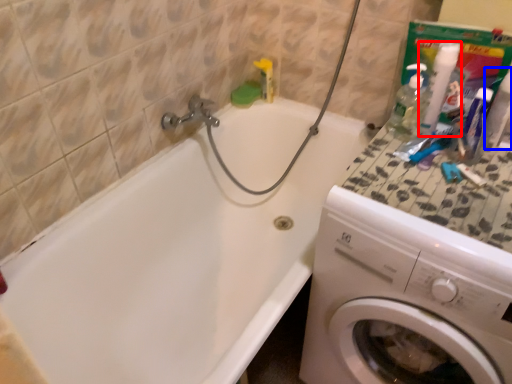
Question: Which point is closer to the camera, cleaning product (highlighted by a red box) or bottle (highlighted by a blue box)?

Choices:
 (A) cleaning product
 (B) bottle

Answer: (B)